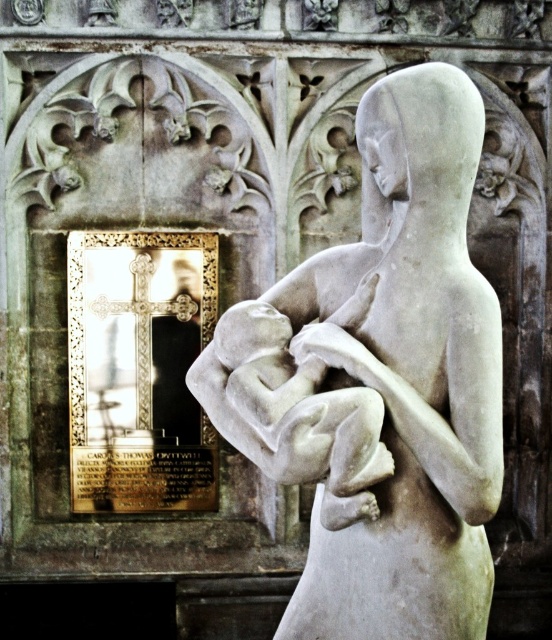
Between white marble statue at center and smooth white baby at center, which one is positioned higher?

white marble statue at center is above.

Which is more to the left, white marble statue at center or smooth white baby at center?

smooth white baby at center

Is point (391, 323) positioned before point (358, 497)?

No, (391, 323) is behind (358, 497).

Locate an element on the screen. white marble statue at center is located at coordinates (381, 381).